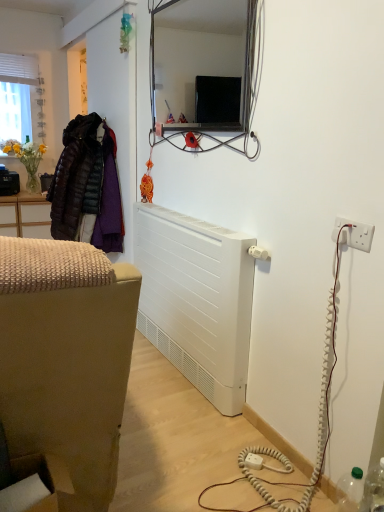
Identify the location of vacant area on top of white matte radiator at lower center (from a real-world perspective). Image resolution: width=384 pixels, height=512 pixels. (196, 217).